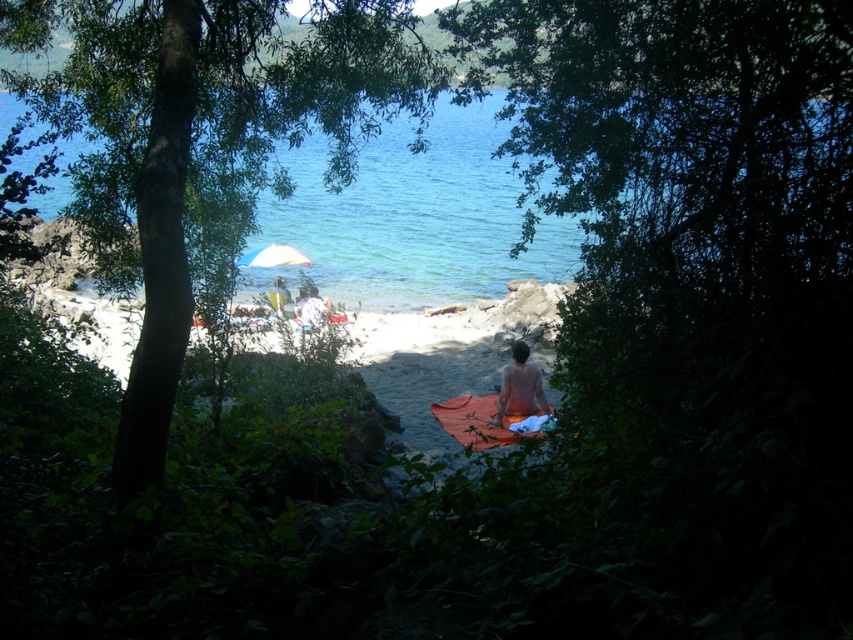
Who is positioned more to the right, clear blue water at center or shiny brown towel at center?

From the viewer's perspective, shiny brown towel at center appears more on the right side.

Can you confirm if clear blue water at center is positioned below shiny brown towel at center?

Actually, clear blue water at center is above shiny brown towel at center.

This screenshot has height=640, width=853. Identify the location of clear blue water at center. (416, 216).

This screenshot has height=640, width=853. I want to click on clear blue water at center, so click(416, 216).

Does green leafy tree at center appear over orange fabric towel at center?

Indeed, green leafy tree at center is positioned over orange fabric towel at center.

Is point (256, 17) positioned before point (444, 390)?

Yes, it is.

At what (x,y) coordinates should I click in order to perform the action: click on green leafy tree at center. Please return your answer as a coordinate pair (x, y). The image size is (853, 640). Looking at the image, I should click on (202, 147).

Does point (164, 442) come in front of point (511, 397)?

Yes, it is.

Who is shorter, green leafy tree at center or shiny brown towel at center?

With less height is shiny brown towel at center.

Identify the location of green leafy tree at center. Image resolution: width=853 pixels, height=640 pixels. (202, 147).

The height and width of the screenshot is (640, 853). I want to click on green leafy tree at center, so click(x=202, y=147).